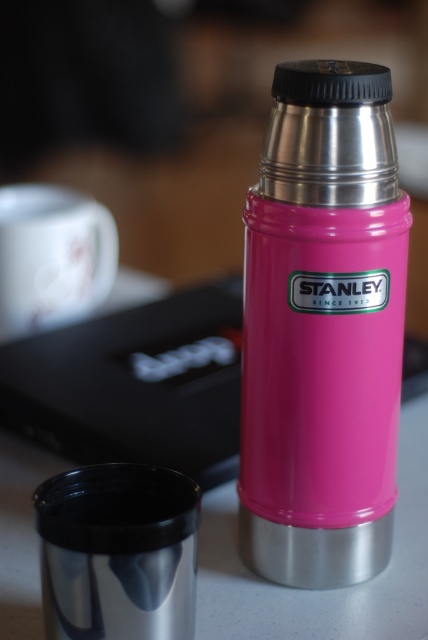
Does shiny metallic mug at center have a greater height compared to white glossy mug at upper left?

In fact, shiny metallic mug at center may be shorter than white glossy mug at upper left.

Is shiny metallic mug at center above white glossy mug at upper left?

Incorrect, shiny metallic mug at center is not positioned above white glossy mug at upper left.

Identify the location of shiny metallic mug at center. (118, 552).

Can you confirm if pink matte stanley thermos at center is positioned to the left of shiny metallic mug at center?

In fact, pink matte stanley thermos at center is to the right of shiny metallic mug at center.

Is the position of pink matte stanley thermos at center less distant than that of shiny metallic mug at center?

No.

Identify the location of pink matte stanley thermos at center. (323, 330).

Does pink matte stanley thermos at center have a larger size compared to white glossy mug at upper left?

Indeed, pink matte stanley thermos at center has a larger size compared to white glossy mug at upper left.

Looking at this image, is pink matte stanley thermos at center positioned at the back of white glossy mug at upper left?

No, it is in front of white glossy mug at upper left.

Does point (357, 218) come in front of point (70, 189)?

Yes.

Locate an element on the screen. The image size is (428, 640). pink matte stanley thermos at center is located at coordinates click(x=323, y=330).